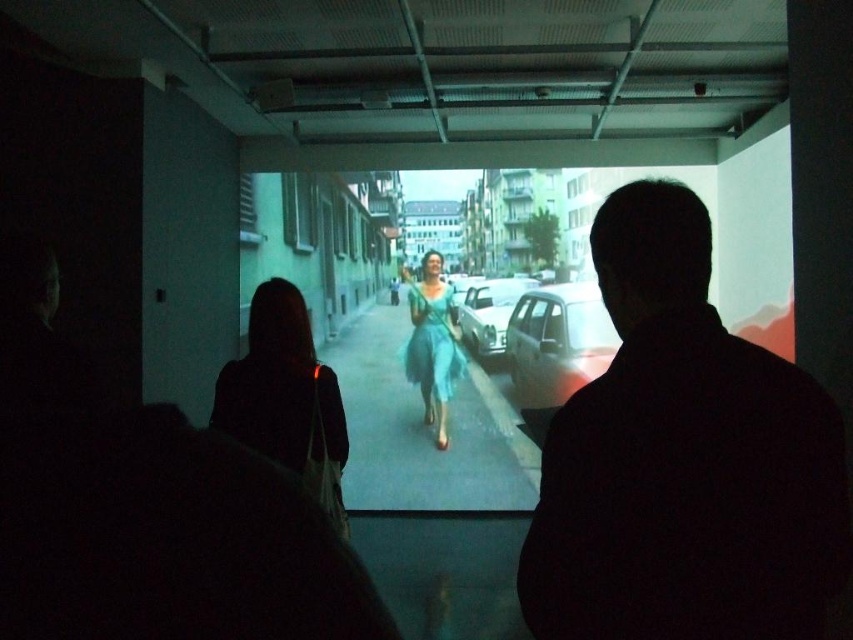
You are an art curator standing in the gallery. You need to place a new sculpture exactly at the center of the room. However, you must ensure that the sculpture does not block the view of the teal tulle dress at center. Given that the room is 10 meters wide and 8 meters long, and the coordinates provided are normalized between 0 and 1, where 0 is the bottom left corner and 1 is the top right corner, can you determine if placing the sculpture at the exact center would block the view of the teal tulle dress?

The teal tulle dress at center is located at coordinates point (286,397). The exact center of the room would be at coordinates (426,320). Since the coordinates of the teal tulle dress are different from the center point, placing the sculpture at the exact center would not block its view.

You are a photographer standing at the back of the art gallery. You want to take a photo of both the teal tulle dress at center and the teal satin dress at center in the foreground. Can you fit both dresses in your shot if your camera has a 2.5 meter wide field of view?

The distance between the teal tulle dress at center and the teal satin dress at center is 3.64 meters. Since your camera can only capture a 2.5 meter wide field of view, the two dresses are too far apart to fit within the frame at the same time.